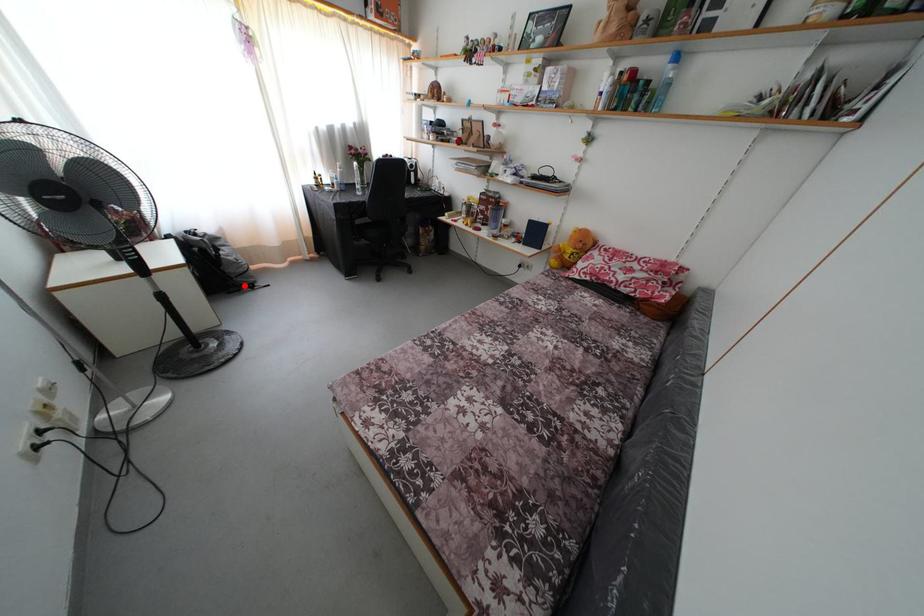
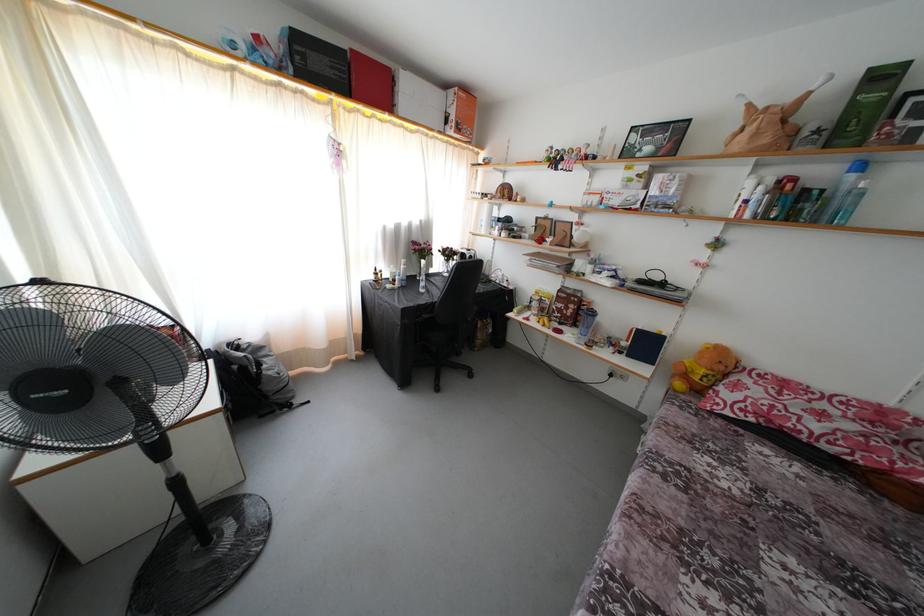
Where in the second image is the point corresponding to the highlighted location from the first image?

(281, 403)